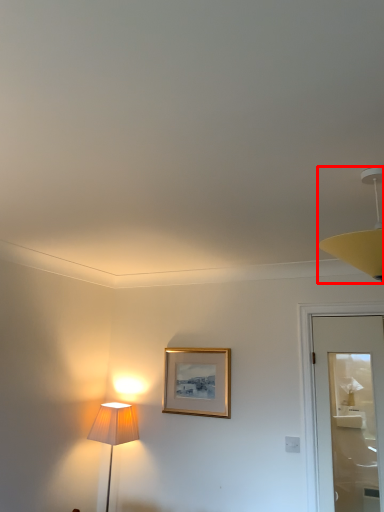
Question: Observing the image, what is the correct spatial positioning of lamp (annotated by the red box) in reference to picture frame?

Choices:
 (A) left
 (B) right

Answer: (B)